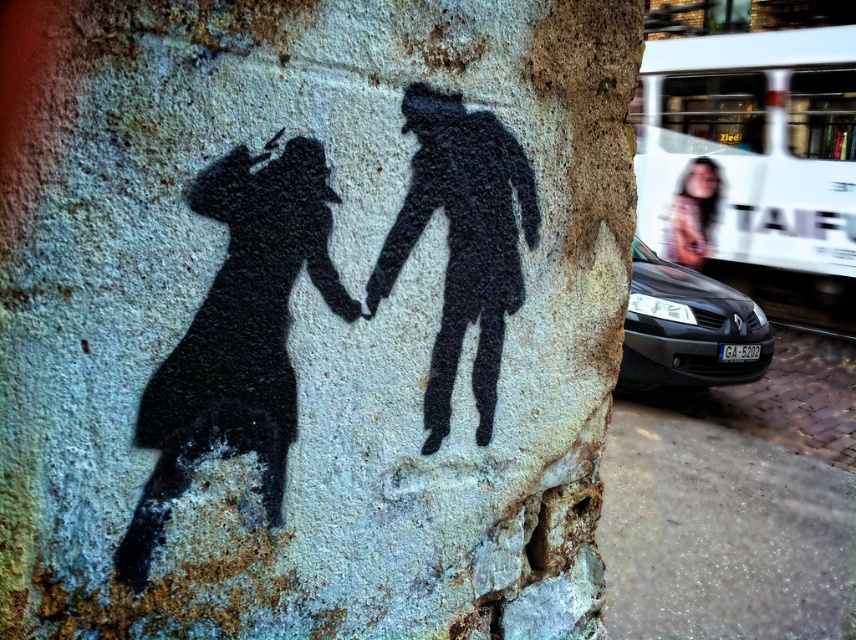
Can you confirm if black textured shadow at center is thinner than black matte car at lower right?

Yes, black textured shadow at center is thinner than black matte car at lower right.

Does point (27, 472) come in front of point (631, 284)?

Yes, it is.

Identify the location of black textured shadow at center. This screenshot has width=856, height=640. (313, 317).

Does black textured shadow at center have a greater width compared to black matte silhouette at center?

Correct, the width of black textured shadow at center exceeds that of black matte silhouette at center.

Based on the photo, between black textured shadow at center and black matte silhouette at center, which one appears on the left side from the viewer's perspective?

black textured shadow at center is more to the left.

The height and width of the screenshot is (640, 856). I want to click on black textured shadow at center, so click(x=313, y=317).

This screenshot has height=640, width=856. In order to click on black textured shadow at center in this screenshot , I will do `click(313, 317)`.

Is black matte car at lower right to the left of smooth skin face at upper right from the viewer's perspective?

Yes, black matte car at lower right is to the left of smooth skin face at upper right.

The height and width of the screenshot is (640, 856). I want to click on black matte car at lower right, so click(688, 326).

Identify the location of black matte car at lower right. Image resolution: width=856 pixels, height=640 pixels. (688, 326).